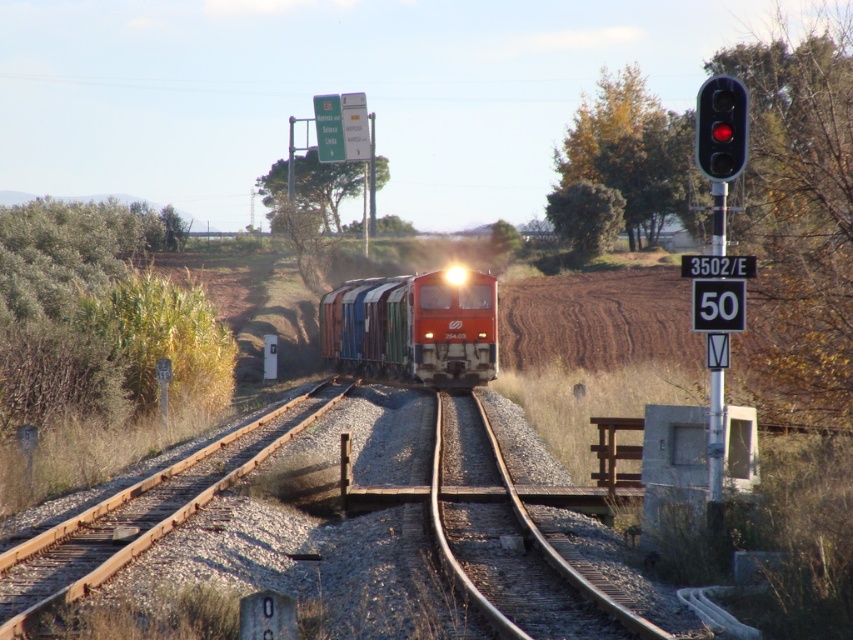
Question: Does yellow-green foliage at upper center have a smaller size compared to red glass traffic light at upper right?

Choices:
 (A) yes
 (B) no

Answer: (B)

Question: Considering the real-world distances, which object is closest to the metallic train track at center?

Choices:
 (A) green leafy tree at upper center
 (B) yellow-green foliage at upper center

Answer: (B)

Question: Which is farther from the green leafy tree at upper center?

Choices:
 (A) metallic train track at center
 (B) green leafy tree at center

Answer: (A)

Question: Is matte red train at center smaller than green leafy tree at upper center?

Choices:
 (A) yes
 (B) no

Answer: (A)

Question: Is matte red train at center smaller than green leafy tree at upper center?

Choices:
 (A) yes
 (B) no

Answer: (A)

Question: Which point is farther to the camera?

Choices:
 (A) green leafy tree at center
 (B) red glass traffic light at upper right
 (C) matte red train at center

Answer: (A)